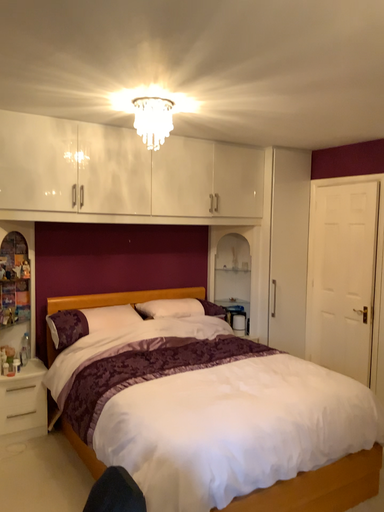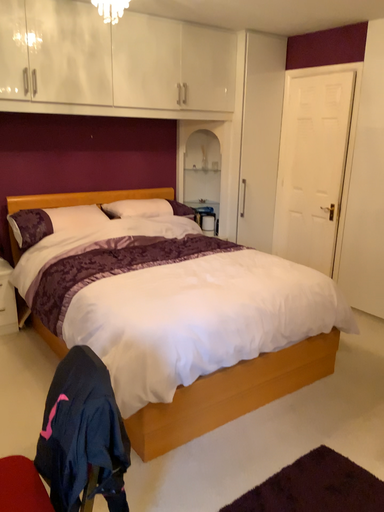
Question: Which way did the camera rotate in the video?

Choices:
 (A) rotated downward
 (B) rotated upward

Answer: (A)